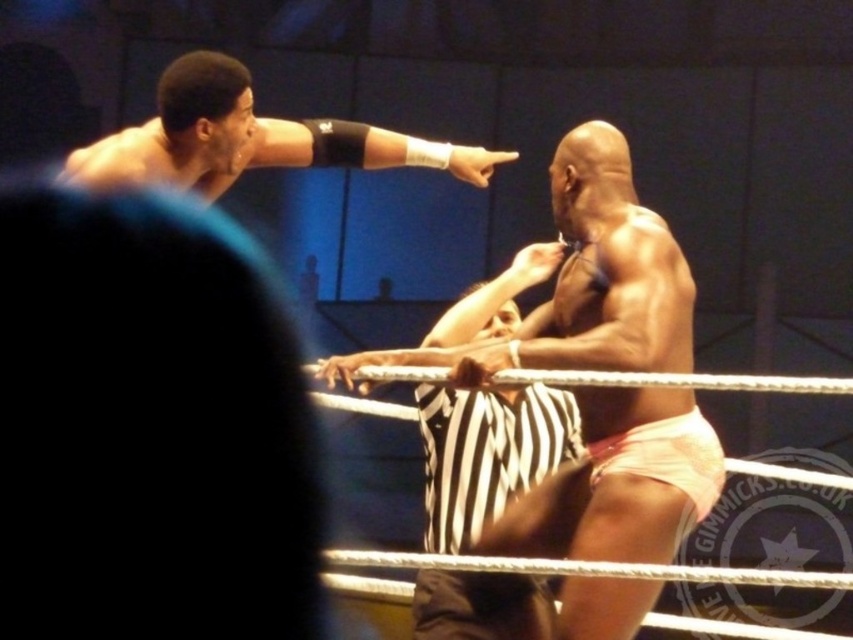
Question: Which of the following is the farthest from the observer?

Choices:
 (A) pink fabric shorts at center
 (B) matte black arm at upper left

Answer: (B)

Question: Can you confirm if pink fabric shorts at center is smaller than matte black arm at upper left?

Choices:
 (A) yes
 (B) no

Answer: (B)

Question: Which point is farther to the camera?

Choices:
 (A) (610, 515)
 (B) (206, 136)

Answer: (B)

Question: Is pink fabric shorts at center bigger than matte black arm at upper left?

Choices:
 (A) no
 (B) yes

Answer: (B)

Question: Is pink fabric shorts at center in front of matte black arm at upper left?

Choices:
 (A) no
 (B) yes

Answer: (B)